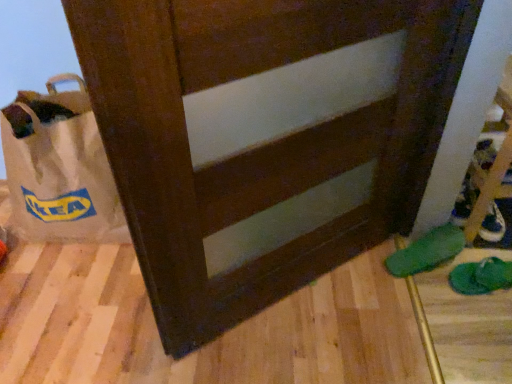
Image resolution: width=512 pixels, height=384 pixels. Identify the location of vacant space in green fabric slipper at lower right, acting as the second footwear starting from the left (from a real-world perspective). (481, 279).